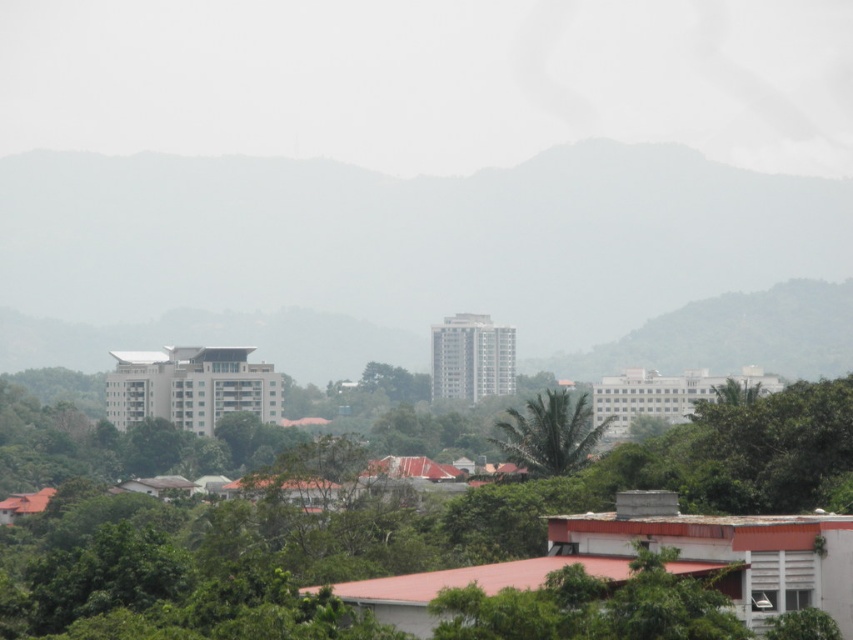
Between green matte mountain at center and green leafy tree at center, which one appears on the right side from the viewer's perspective?

green matte mountain at center is more to the right.

The image size is (853, 640). I want to click on green matte mountain at center, so click(386, 252).

Can you confirm if green matte mountain at center is positioned below green leafy palm at center?

Incorrect, green matte mountain at center is not positioned below green leafy palm at center.

Is point (589, 221) positioned after point (554, 440)?

Yes, point (589, 221) is behind point (554, 440).

Is point (227, 221) less distant than point (548, 465)?

No.

Locate an element on the screen. green matte mountain at center is located at coordinates (386, 252).

Consider the image. Is green leafy tree at center to the left of green leafy palm at center from the viewer's perspective?

Correct, you'll find green leafy tree at center to the left of green leafy palm at center.

What do you see at coordinates (450, 536) in the screenshot?
I see `green leafy tree at center` at bounding box center [450, 536].

Does point (618, 550) come farther from viewer compared to point (512, 406)?

No, (618, 550) is in front of (512, 406).

Where is `green leafy tree at center`? The width and height of the screenshot is (853, 640). green leafy tree at center is located at coordinates (450, 536).